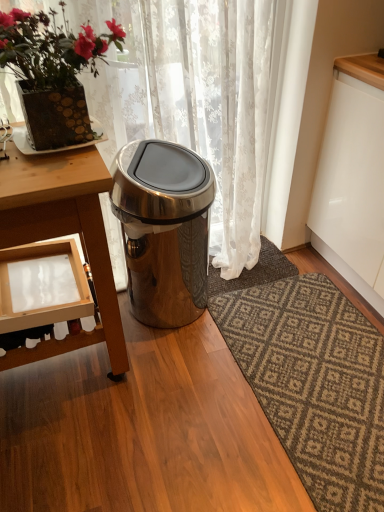
Question: Can you confirm if dark gray textured rug at center is bigger than satin silver trash can at center?

Choices:
 (A) yes
 (B) no

Answer: (B)

Question: Is the position of dark gray textured rug at center less distant than that of satin silver trash can at center?

Choices:
 (A) no
 (B) yes

Answer: (A)

Question: From the image's perspective, is dark gray textured rug at center over satin silver trash can at center?

Choices:
 (A) yes
 (B) no

Answer: (B)

Question: From a real-world perspective, is dark gray textured rug at center located higher than satin silver trash can at center?

Choices:
 (A) no
 (B) yes

Answer: (A)

Question: Can you confirm if dark gray textured rug at center is thinner than satin silver trash can at center?

Choices:
 (A) no
 (B) yes

Answer: (B)

Question: Can you confirm if dark gray textured rug at center is wider than satin silver trash can at center?

Choices:
 (A) yes
 (B) no

Answer: (B)

Question: Considering the relative positions of white lace curtain at upper center and satin silver trash can at center in the image provided, is white lace curtain at upper center in front of satin silver trash can at center?

Choices:
 (A) yes
 (B) no

Answer: (A)

Question: From the image's perspective, would you say white lace curtain at upper center is positioned over satin silver trash can at center?

Choices:
 (A) yes
 (B) no

Answer: (A)

Question: Does white lace curtain at upper center lie behind satin silver trash can at center?

Choices:
 (A) no
 (B) yes

Answer: (A)

Question: Is white lace curtain at upper center positioned with its back to satin silver trash can at center?

Choices:
 (A) no
 (B) yes

Answer: (B)

Question: Does white lace curtain at upper center have a larger size compared to satin silver trash can at center?

Choices:
 (A) yes
 (B) no

Answer: (A)

Question: From the image's perspective, is white lace curtain at upper center beneath satin silver trash can at center?

Choices:
 (A) yes
 (B) no

Answer: (B)

Question: From a real-world perspective, is white lace curtain at upper center positioned over dark gray textured rug at center based on gravity?

Choices:
 (A) yes
 (B) no

Answer: (A)